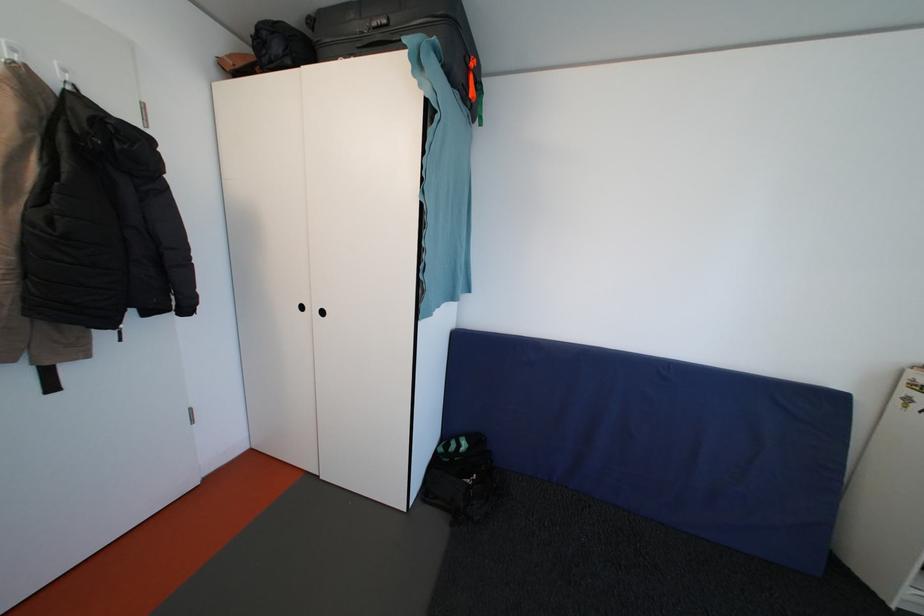
Find the location of a particular element. The width and height of the screenshot is (924, 616). sofa sitting surface is located at coordinates (634, 464).